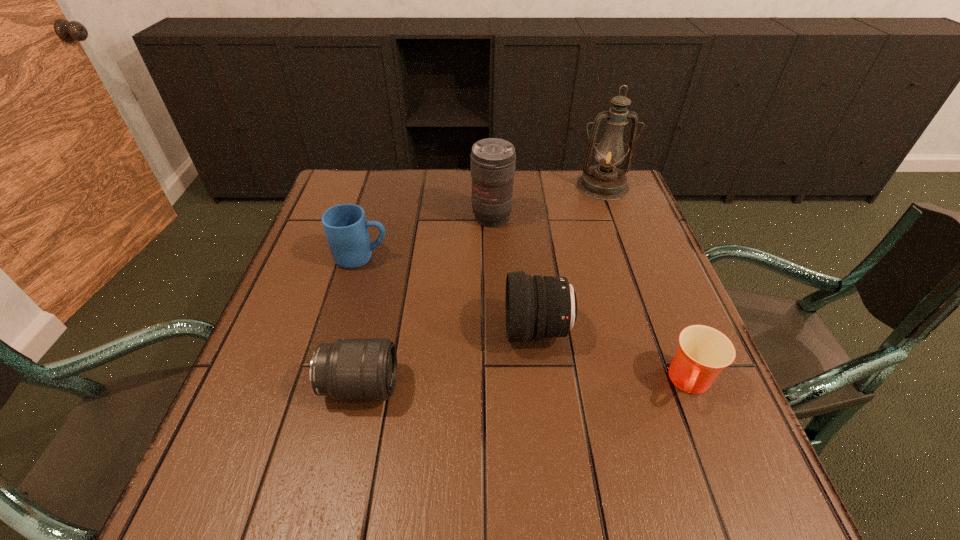
At what (x,y) coordinates should I click in order to perform the action: click on the tallest object. Please return your answer as a coordinate pair (x, y). Looking at the image, I should click on (604, 182).

You are a GUI agent. You are given a task and a screenshot of the screen. Output one action in this format:
    pyautogui.click(x=<x>, y=<y>)
    Task: Click on the farthest object
    
    Given the screenshot: What is the action you would take?
    pyautogui.click(x=604, y=182)

At what (x,y) coordinates should I click in order to perform the action: click on the tallest telephoto lens. Please return your answer as a coordinate pair (x, y). The image size is (960, 540). Looking at the image, I should click on (492, 160).

Image resolution: width=960 pixels, height=540 pixels. Find the location of `the farthest telephoto lens`. the farthest telephoto lens is located at coordinates (492, 160).

Where is `the second nearest telephoto lens`? the second nearest telephoto lens is located at coordinates (537, 306).

Identify the location of mug. (346, 229).

Where is `the shortest telephoto lens`? Image resolution: width=960 pixels, height=540 pixels. the shortest telephoto lens is located at coordinates (349, 369).

Identify the location of the leftmost telephoto lens. (349, 369).

Locate an element on the screen. cup is located at coordinates (703, 352).

Find the location of a particular element. The image size is (960, 540). free space located 0.160m on the left of the oil lamp is located at coordinates (522, 186).